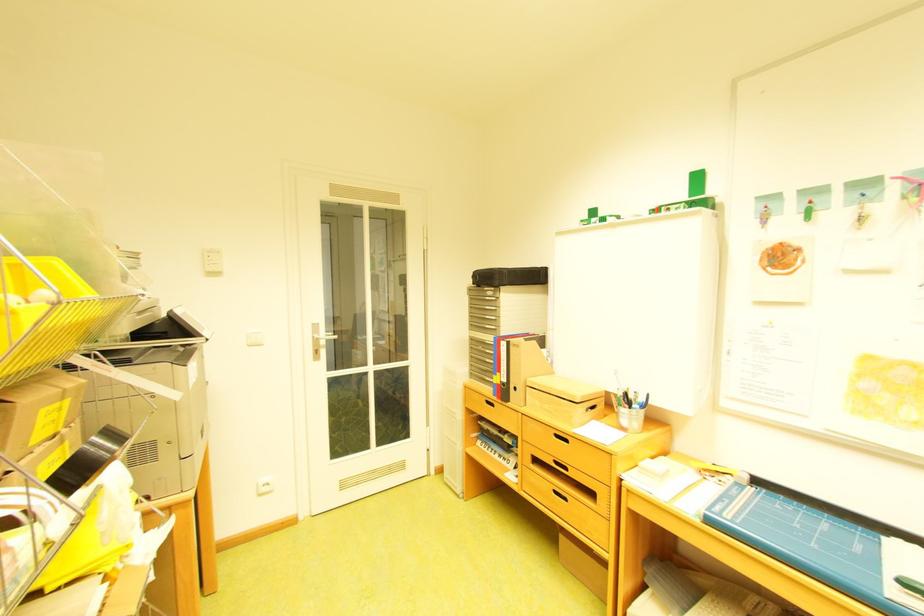
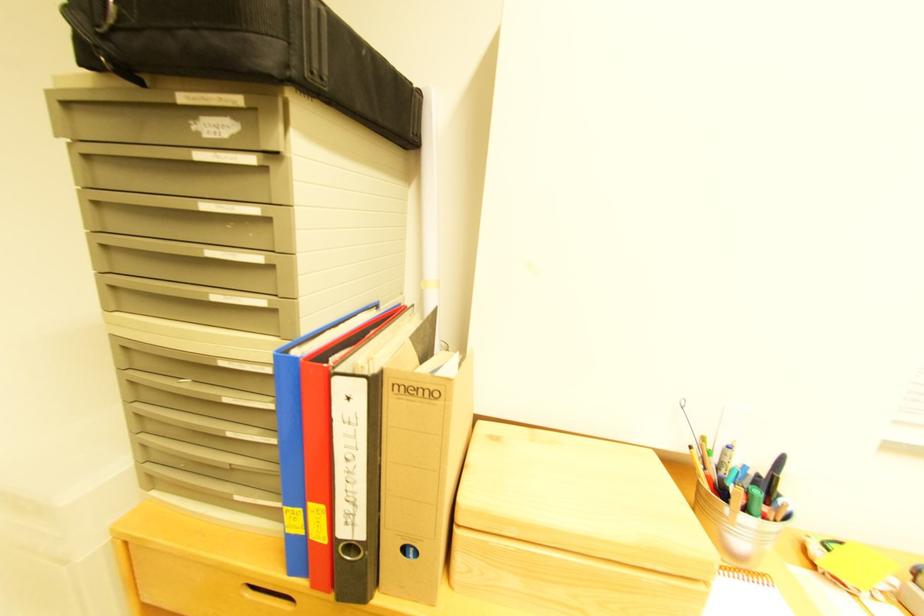
Find the pixel in the second image that matches (517,274) in the first image.

(330, 10)